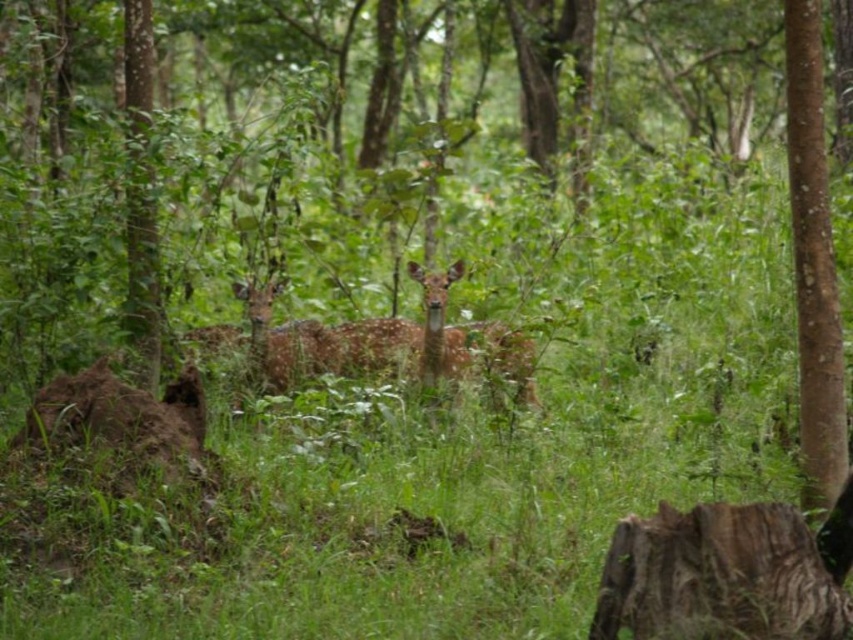
Can you confirm if brown smooth tree trunk at right is taller than spotted fur deer at center?

Yes.

Who is more distant from viewer, [811,502] or [396,346]?

The point [396,346] is more distant.

At what (x,y) coordinates should I click in order to perform the action: click on brown smooth tree trunk at right. Please return your answer as a coordinate pair (x, y). The image size is (853, 640). Looking at the image, I should click on (813, 262).

Image resolution: width=853 pixels, height=640 pixels. In order to click on brown smooth tree trunk at right in this screenshot , I will do `click(813, 262)`.